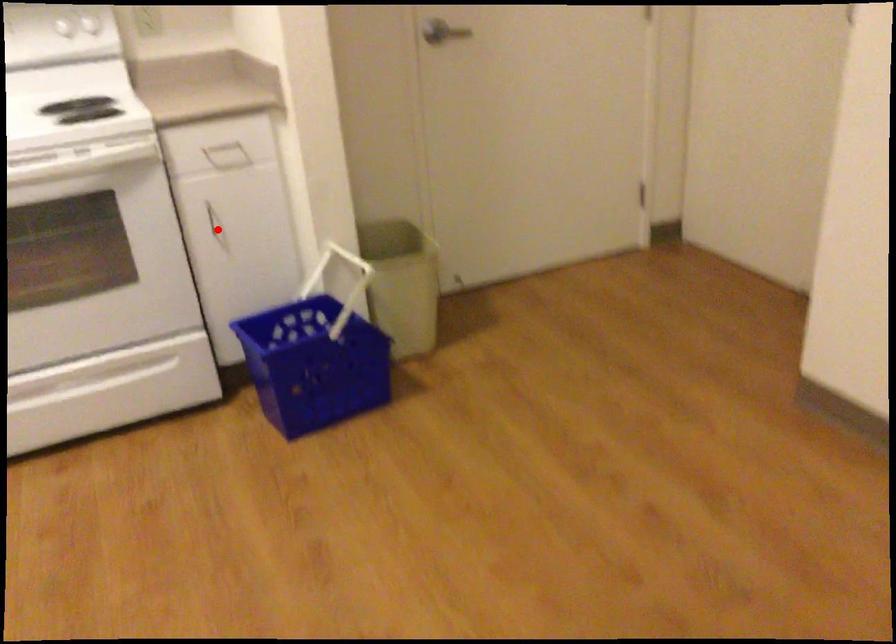
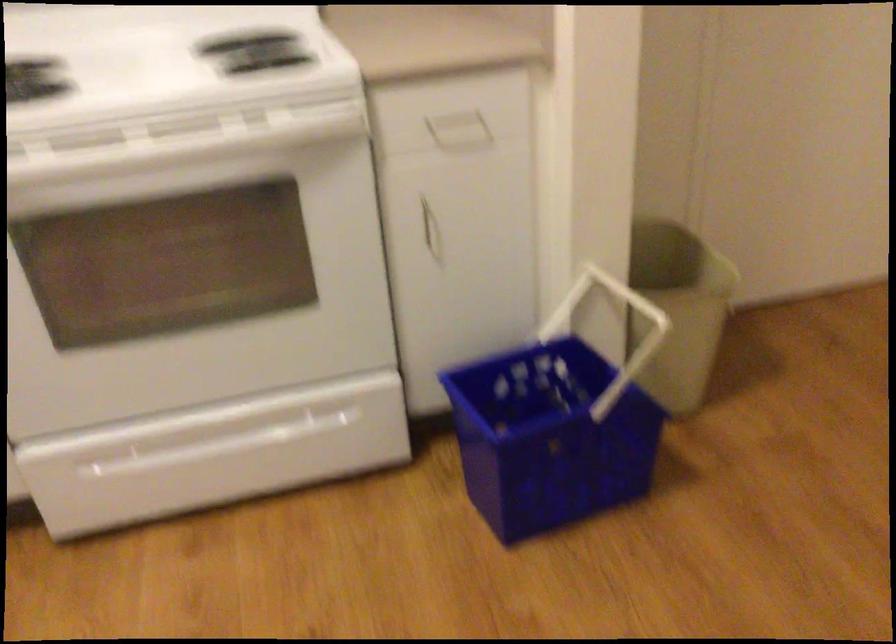
Question: I am providing you with two images of the same scene from different viewpoints. Image1 has a red point marked. In image2, the corresponding 3D location appears at what relative position? Reply with the corresponding letter.

Choices:
 (A) Closer
 (B) Farther

Answer: (A)